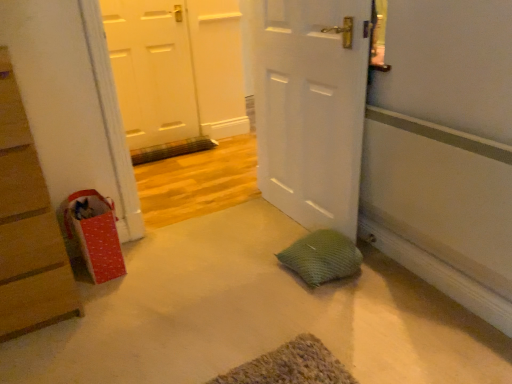
You are a GUI agent. You are given a task and a screenshot of the screen. Output one action in this format:
    pyautogui.click(x=<x>, y=<y>)
    Task: Click on the free location in front of green mesh pillow at center
    
    Given the screenshot: What is the action you would take?
    pyautogui.click(x=326, y=306)